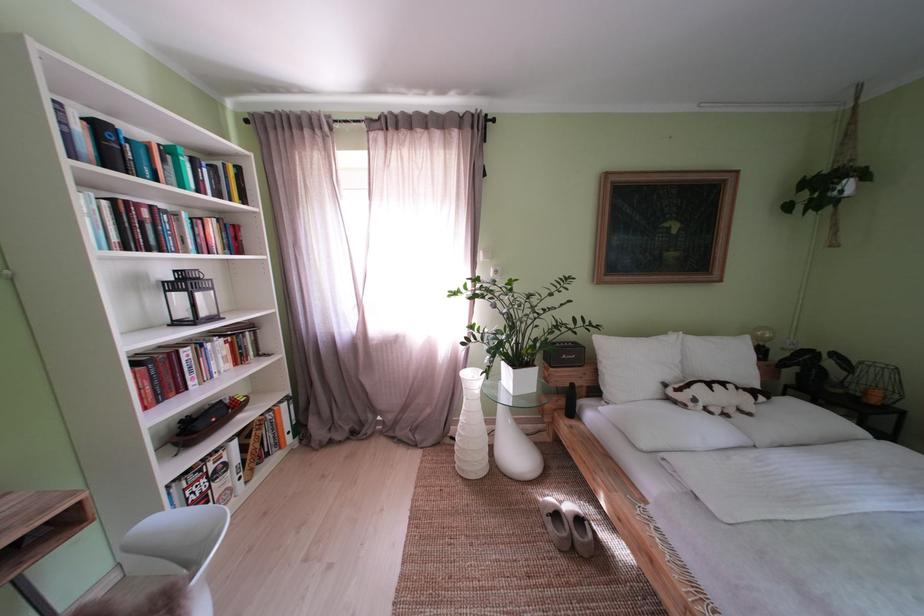
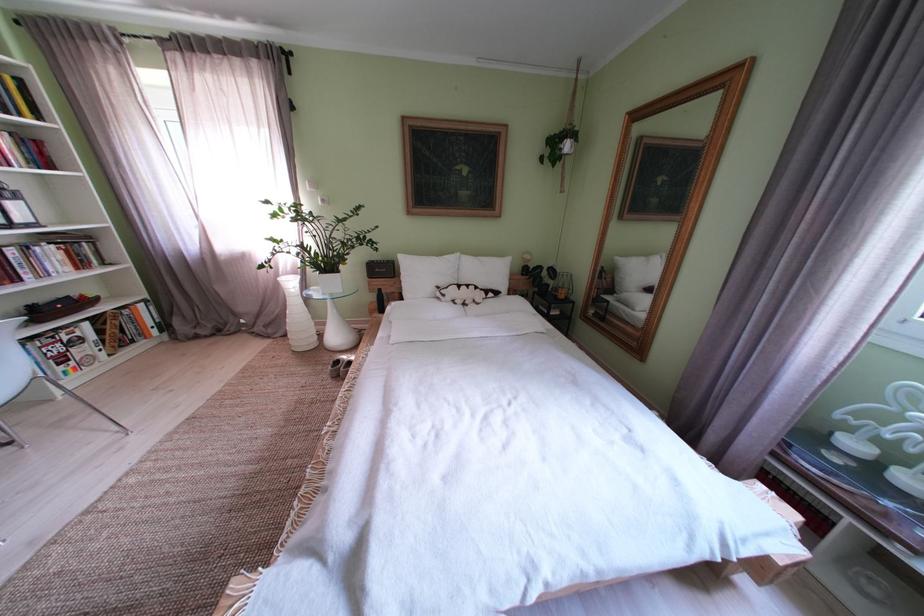
The point at (220,351) is marked in the first image. Where is the corresponding point in the second image?

(49, 254)